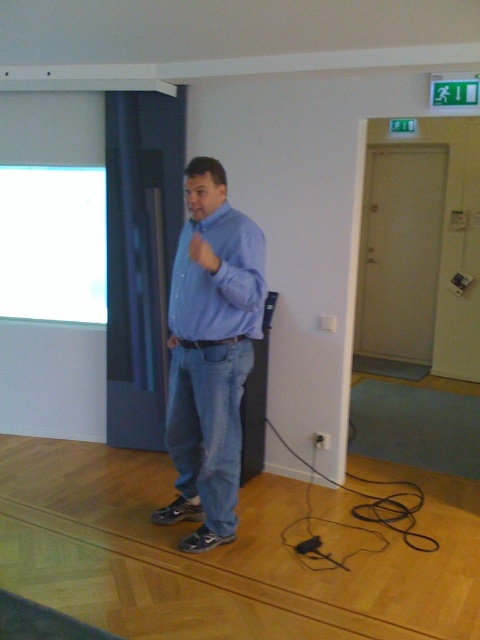
Question: Which object appears closest to the camera in this image?

Choices:
 (A) blue denim jeans at center
 (B) blue cotton shirt at center

Answer: (A)

Question: Can you confirm if blue denim jeans at center is smaller than blue cotton shirt at center?

Choices:
 (A) yes
 (B) no

Answer: (B)

Question: Which point is closer to the camera?

Choices:
 (A) blue cotton shirt at center
 (B) blue denim jeans at center
 (C) white glossy projection screen at upper left

Answer: (B)

Question: Among these objects, which one is nearest to the camera?

Choices:
 (A) white glossy projection screen at upper left
 (B) blue denim jeans at center

Answer: (B)

Question: Is white glossy projection screen at upper left to the left of blue cotton shirt at center from the viewer's perspective?

Choices:
 (A) no
 (B) yes

Answer: (B)

Question: Does blue denim jeans at center lie behind white glossy projection screen at upper left?

Choices:
 (A) yes
 (B) no

Answer: (B)